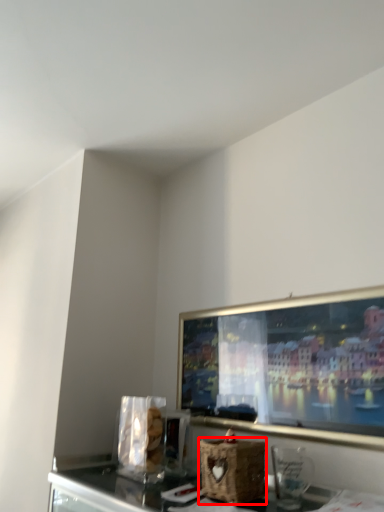
Question: From the image's perspective, what is the correct spatial relationship of basket (annotated by the red box) in relation to appliance?

Choices:
 (A) below
 (B) above

Answer: (A)